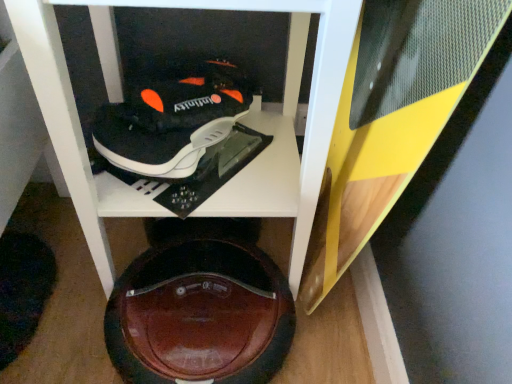
The width and height of the screenshot is (512, 384). I want to click on vacant region above shiny brown shoe at bottom center (from a real-world perspective), so click(201, 297).